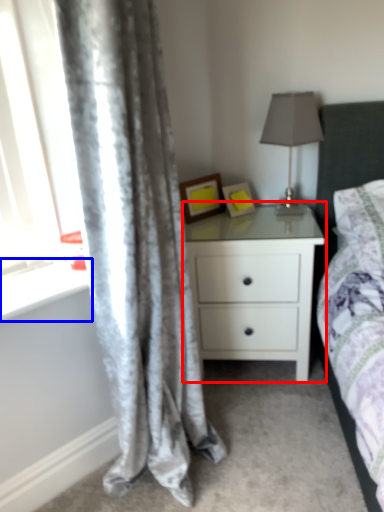
Question: Which object appears farthest to the camera in this image, nightstand (highlighted by a red box) or window sill (highlighted by a blue box)?

Choices:
 (A) nightstand
 (B) window sill

Answer: (A)